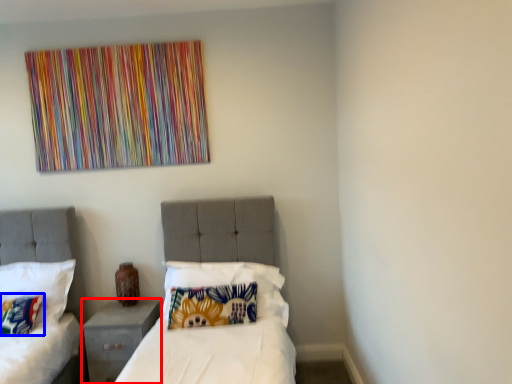
Question: Which point is further to the camera, nightstand (highlighted by a red box) or pillow (highlighted by a blue box)?

Choices:
 (A) nightstand
 (B) pillow

Answer: (A)